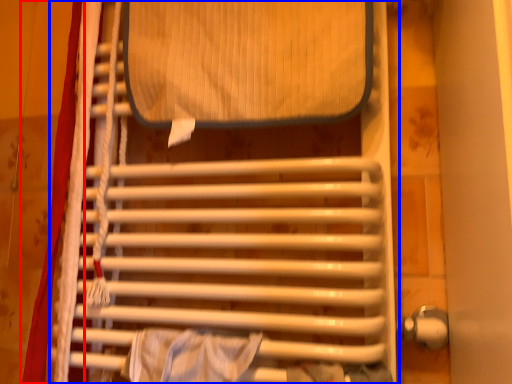
Question: Which point is closer to the camera, curtain (highlighted by a red box) or furniture (highlighted by a blue box)?

Choices:
 (A) curtain
 (B) furniture

Answer: (B)